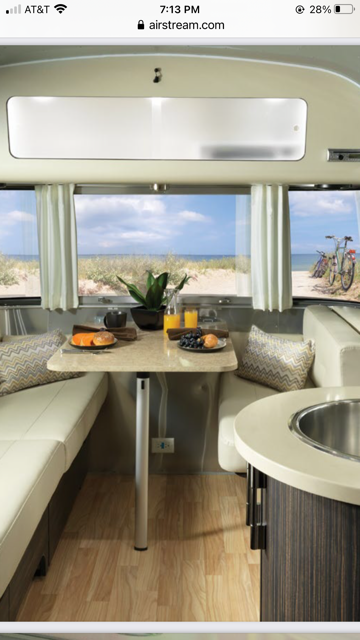
Image resolution: width=360 pixels, height=640 pixels. What are the coordinates of `plate` in the screenshot? It's located at click(x=221, y=345).